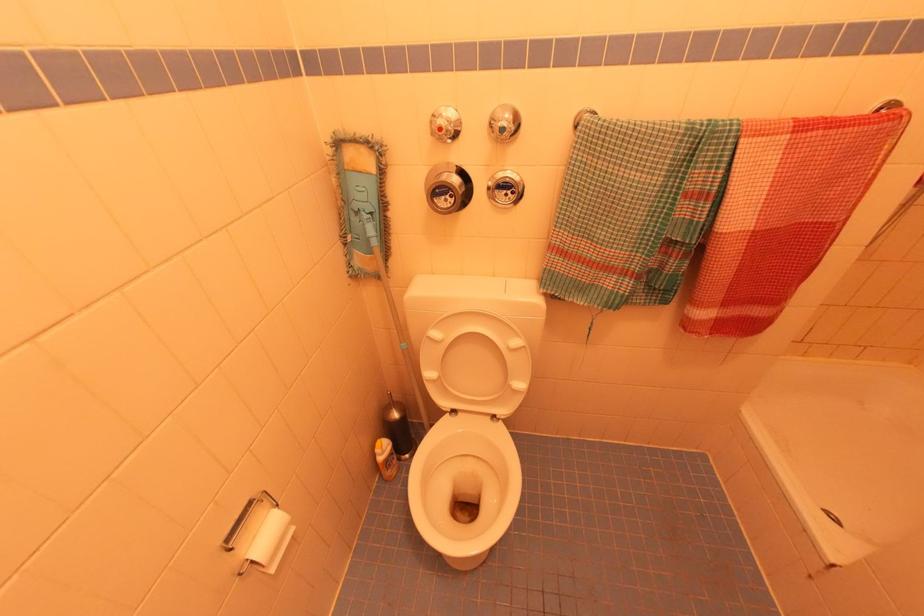
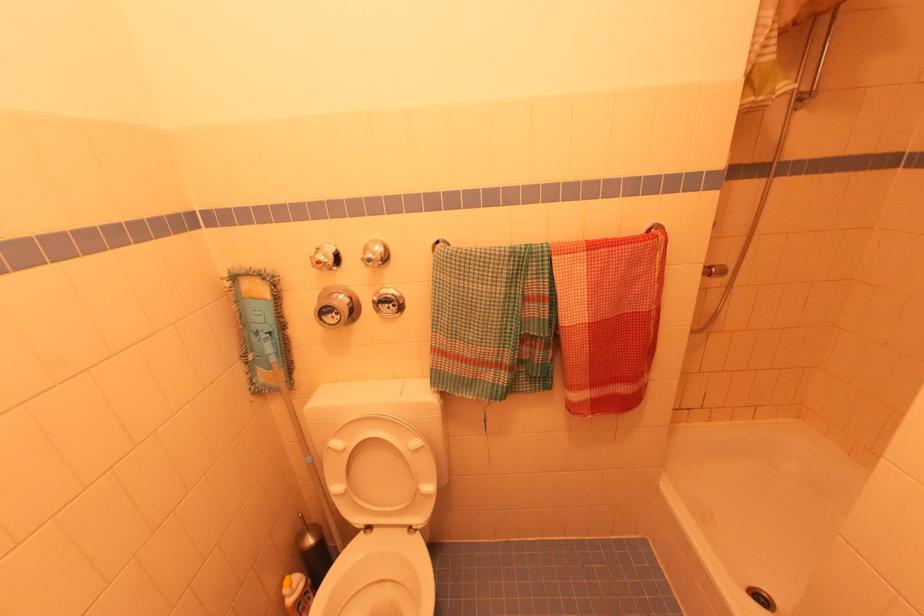
The point at (450, 123) is marked in the first image. Where is the corresponding point in the second image?

(327, 257)